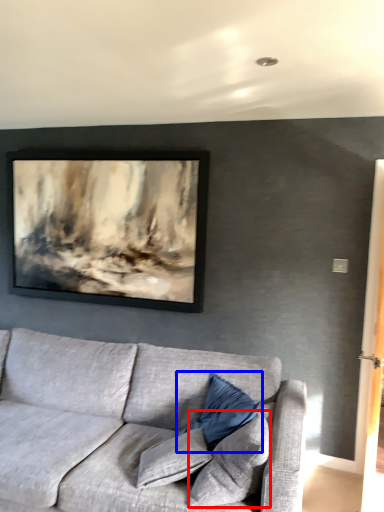
Question: Which object is closer to the camera taking this photo, pillow (highlighted by a red box) or pillow (highlighted by a blue box)?

Choices:
 (A) pillow
 (B) pillow

Answer: (A)